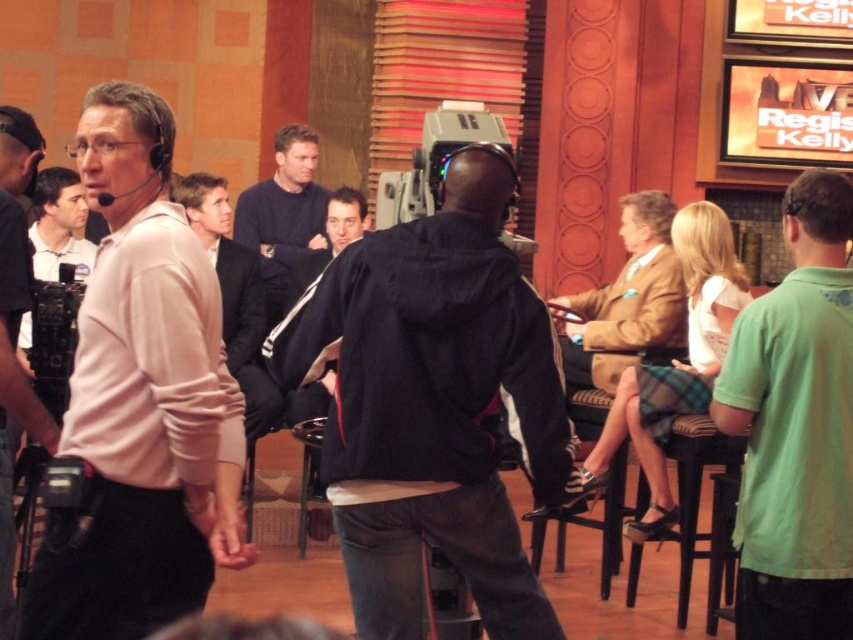
Question: Which point is closer to the camera?

Choices:
 (A) (726, 369)
 (B) (334, 196)
 (C) (241, 264)
 (D) (679, 598)

Answer: (A)

Question: Among these points, which one is nearest to the camera?

Choices:
 (A) (308, 250)
 (B) (123, 438)
 (C) (689, 586)

Answer: (B)

Question: Can you confirm if brown leather jacket at center is positioned to the right of dark blue suit at center?

Choices:
 (A) no
 (B) yes

Answer: (B)

Question: Which point is closer to the camera taking this photo?

Choices:
 (A) (229, 284)
 (B) (236, 209)
 (C) (735, 490)

Answer: (C)

Question: Can you confirm if brown leather jacket at center is positioned below dark blue suit at center?

Choices:
 (A) yes
 (B) no

Answer: (A)

Question: In this image, where is pink matte shirt at left located relative to dark blue sweater at center?

Choices:
 (A) below
 (B) above

Answer: (A)